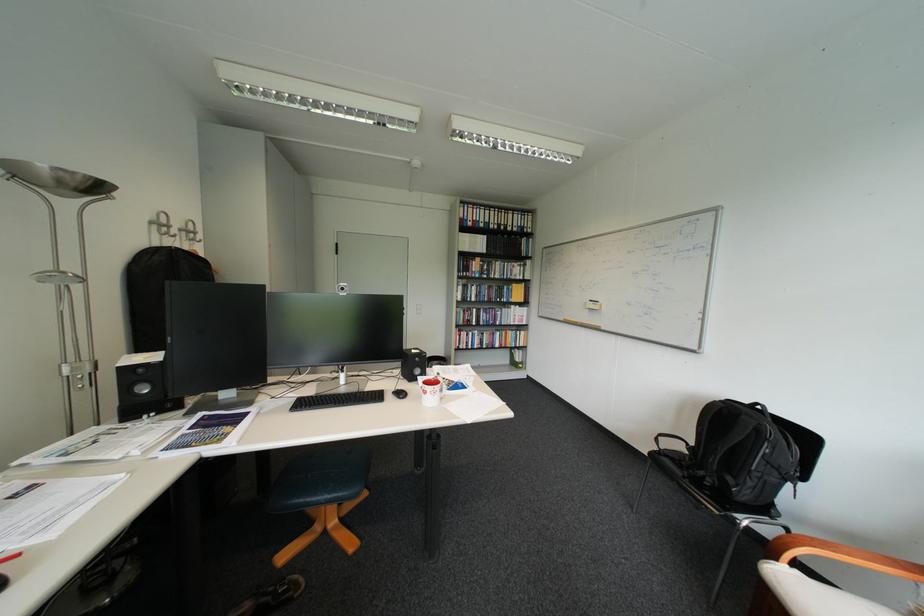
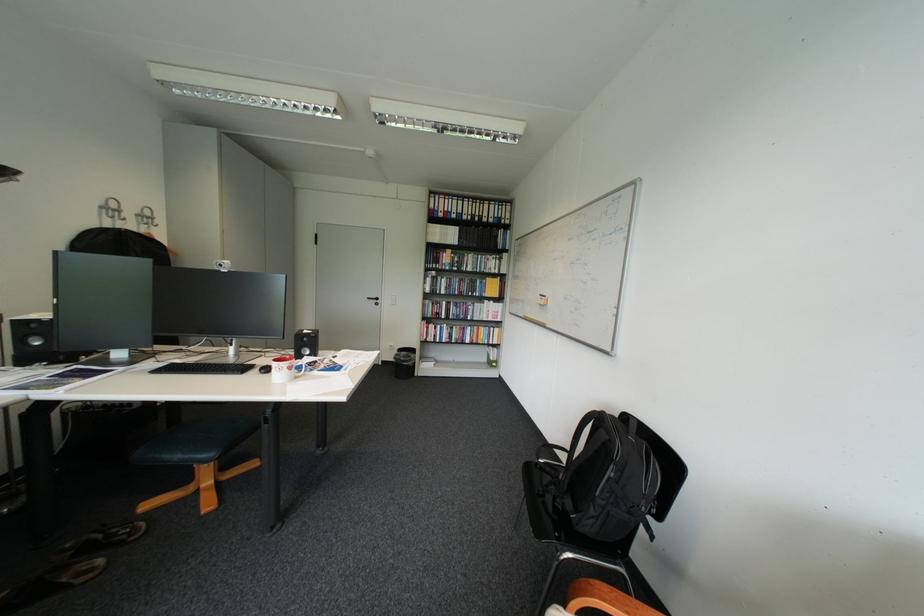
Locate, in the second image, the point that corresponds to pixel 321 500 in the first image.

(176, 456)